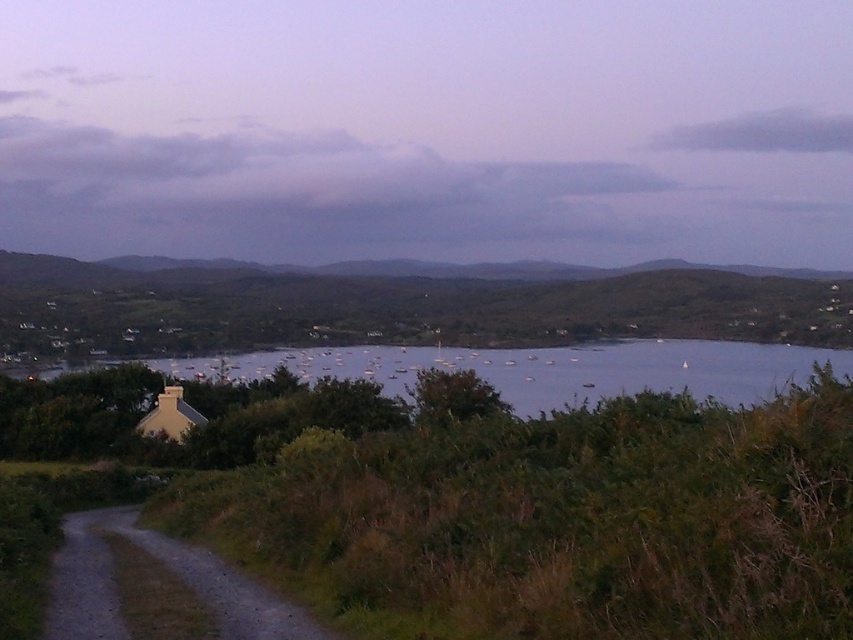
Question: Is green grassy hillside at center to the right of dirt/gravel path at lower left from the viewer's perspective?

Choices:
 (A) no
 (B) yes

Answer: (A)

Question: Which object is positioned farthest from the clear water at center?

Choices:
 (A) cloudy sky at upper center
 (B) dirt/gravel path at lower left
 (C) green grassy hillside at center

Answer: (A)

Question: Among these objects, which one is farthest from the camera?

Choices:
 (A) dirt/gravel path at lower left
 (B) clear water at center

Answer: (B)

Question: Can you confirm if cloudy sky at upper center is positioned below clear water at center?

Choices:
 (A) no
 (B) yes

Answer: (A)

Question: Does clear water at center appear on the right side of dirt/gravel path at lower left?

Choices:
 (A) no
 (B) yes

Answer: (B)

Question: Which of the following is the farthest from the observer?

Choices:
 (A) (590, 292)
 (B) (587, 376)
 (C) (199, 586)
 (D) (164, 170)

Answer: (D)